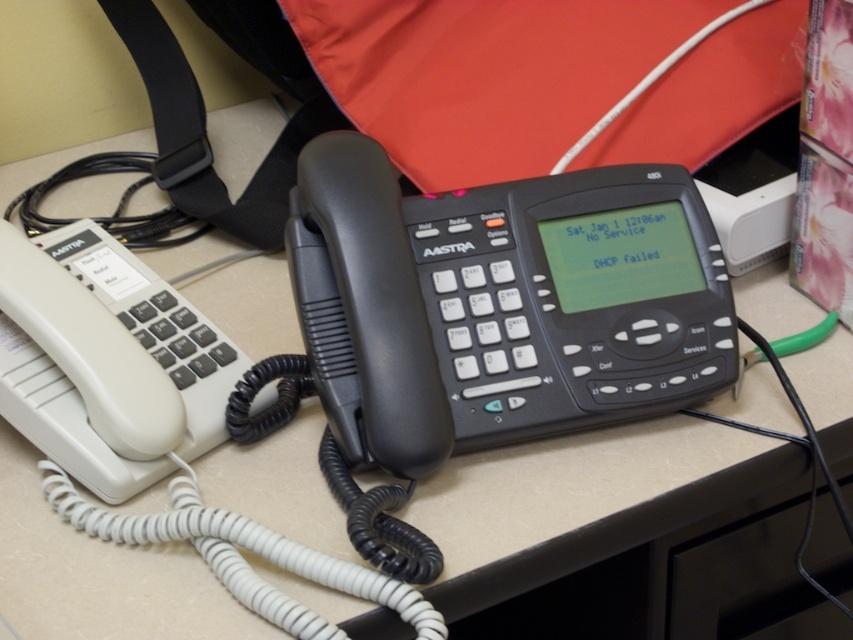
Question: Is white matte/soft plastic phone at left above white cord at lower left?

Choices:
 (A) yes
 (B) no

Answer: (A)

Question: Does white matte/soft plastic phone at left have a smaller size compared to white cord at lower left?

Choices:
 (A) yes
 (B) no

Answer: (B)

Question: Which point is closer to the camera?

Choices:
 (A) white matte/soft plastic phone at left
 (B) white cord at lower left

Answer: (B)

Question: Is white matte/soft plastic phone at left thinner than white cord at lower left?

Choices:
 (A) yes
 (B) no

Answer: (A)